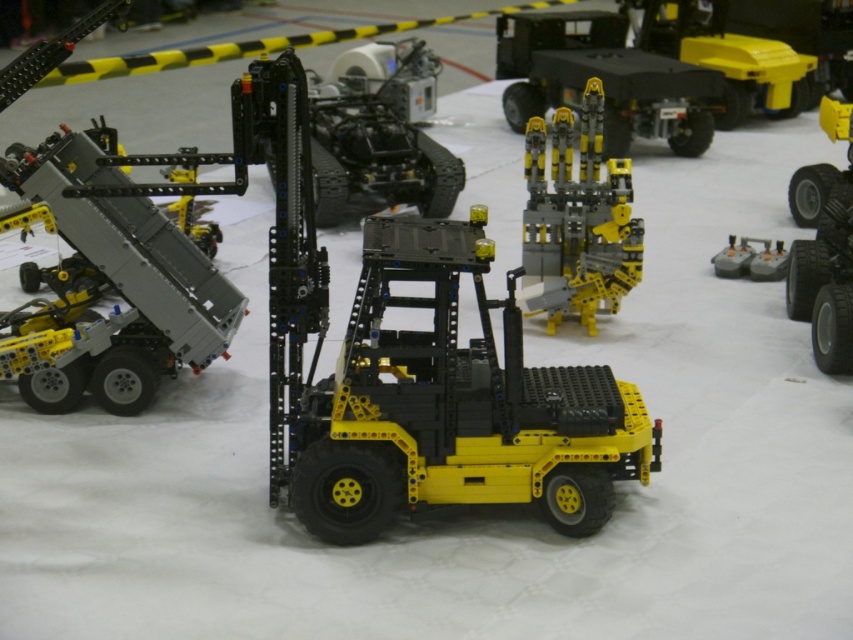
Is yellow matte mechanical arm at center bigger than yellow matte truck at right?

No.

Which is in front, point (592, 193) or point (828, 256)?

Point (592, 193)

Does point (596, 216) lie behind point (804, 173)?

No, (596, 216) is in front of (804, 173).

Where is `yellow matte mechanical arm at center`? The width and height of the screenshot is (853, 640). yellow matte mechanical arm at center is located at coordinates (577, 220).

Can you confirm if yellow matte robotic claw at center is positioned above yellow plastic forklift at center?

Correct, yellow matte robotic claw at center is located above yellow plastic forklift at center.

Is point (579, 12) positioned after point (334, 84)?

That is True.

Which is behind, point (640, 99) or point (343, 124)?

The point (640, 99) is more distant.

The height and width of the screenshot is (640, 853). I want to click on yellow matte robotic claw at center, so (604, 80).

Is yellow matte robotic claw at center smaller than yellow matte truck at right?

No, yellow matte robotic claw at center is not smaller than yellow matte truck at right.

Is point (614, 156) less distant than point (811, 179)?

No.

Find the location of a particular element. The height and width of the screenshot is (640, 853). yellow matte robotic claw at center is located at coordinates (604, 80).